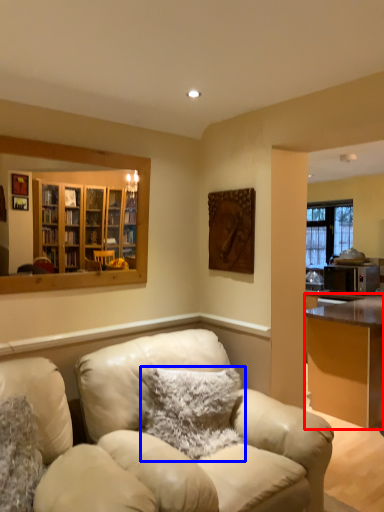
Question: Which of the following is the closest to the observer, desk (highlighted by a red box) or pillow (highlighted by a blue box)?

Choices:
 (A) desk
 (B) pillow

Answer: (B)